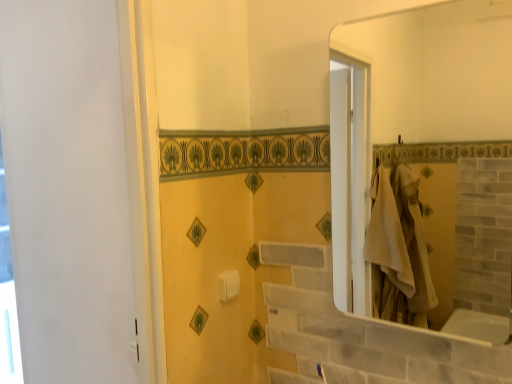
Question: Considering their positions, is white glossy mirror at upper right located in front of or behind white glossy window at left?

Choices:
 (A) behind
 (B) front

Answer: (B)

Question: Based on their positions, is white glossy mirror at upper right located to the left or right of white glossy window at left?

Choices:
 (A) right
 (B) left

Answer: (A)

Question: Which of these objects is positioned closest to the white glossy window at left?

Choices:
 (A) white glossy mirror at upper right
 (B) white plastic towel bar at center

Answer: (B)

Question: Which of these objects is positioned closest to the white glossy window at left?

Choices:
 (A) white glossy mirror at upper right
 (B) white plastic towel bar at center

Answer: (B)